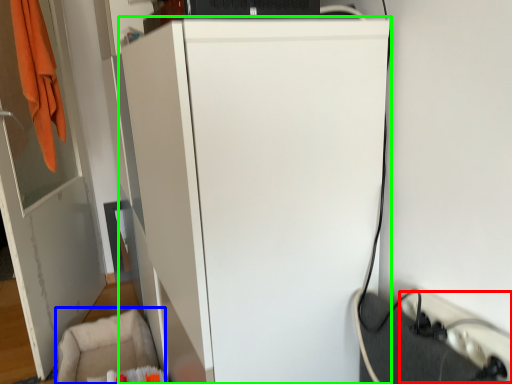
Question: Estimate the real-world distances between objects in this image. Which object is farther from extension cord (highlighted by a red box), swivel chair (highlighted by a blue box) or refrigerator (highlighted by a green box)?

Choices:
 (A) swivel chair
 (B) refrigerator

Answer: (A)